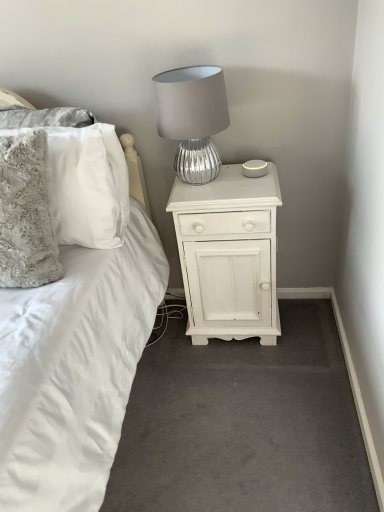
Question: Is white painted wood nightstand at center oriented away from fluffy gray pillow at left, the 2th pillow in the back-to-front sequence?

Choices:
 (A) no
 (B) yes

Answer: (A)

Question: Is white painted wood nightstand at center completely or partially outside of fluffy gray pillow at left, the 2th pillow in the back-to-front sequence?

Choices:
 (A) yes
 (B) no

Answer: (A)

Question: Does white painted wood nightstand at center lie behind fluffy gray pillow at left, marked as the 1th pillow in a front-to-back arrangement?

Choices:
 (A) yes
 (B) no

Answer: (A)

Question: Does white painted wood nightstand at center have a greater width compared to fluffy gray pillow at left, the 2th pillow in the back-to-front sequence?

Choices:
 (A) yes
 (B) no

Answer: (A)

Question: From the image's perspective, is white painted wood nightstand at center on fluffy gray pillow at left, the 2th pillow in the back-to-front sequence?

Choices:
 (A) no
 (B) yes

Answer: (A)

Question: Would you say fluffy white pillow at left, which is the second pillow from front to back, is inside or outside fluffy gray pillow at left, marked as the 1th pillow in a front-to-back arrangement?

Choices:
 (A) outside
 (B) inside

Answer: (A)

Question: In the image, is fluffy white pillow at left, the first pillow viewed from the back, positioned in front of or behind fluffy gray pillow at left, marked as the 1th pillow in a front-to-back arrangement?

Choices:
 (A) behind
 (B) front

Answer: (A)

Question: Considering the positions of point (61, 168) and point (9, 270), is point (61, 168) closer or farther from the camera than point (9, 270)?

Choices:
 (A) farther
 (B) closer

Answer: (A)

Question: From a real-world perspective, is fluffy white pillow at left, which is the second pillow from front to back, physically located above or below fluffy gray pillow at left, marked as the 1th pillow in a front-to-back arrangement?

Choices:
 (A) below
 (B) above

Answer: (A)

Question: Is fluffy gray pillow at left, the 2th pillow in the back-to-front sequence, in front of or behind fluffy white pillow at left, which is the second pillow from front to back, in the image?

Choices:
 (A) front
 (B) behind

Answer: (A)

Question: Choose the correct answer: Is fluffy gray pillow at left, marked as the 1th pillow in a front-to-back arrangement, inside fluffy white pillow at left, which is the second pillow from front to back, or outside it?

Choices:
 (A) inside
 (B) outside

Answer: (B)

Question: From a real-world perspective, is fluffy gray pillow at left, marked as the 1th pillow in a front-to-back arrangement, above or below fluffy white pillow at left, the first pillow viewed from the back?

Choices:
 (A) above
 (B) below

Answer: (A)

Question: From their relative heights in the image, would you say fluffy gray pillow at left, the 2th pillow in the back-to-front sequence, is taller or shorter than fluffy white pillow at left, which is the second pillow from front to back?

Choices:
 (A) short
 (B) tall

Answer: (B)

Question: Is white painted wood nightstand at center spatially inside fluffy gray pillow at left, marked as the 1th pillow in a front-to-back arrangement, or outside of it?

Choices:
 (A) inside
 (B) outside

Answer: (B)

Question: Is white painted wood nightstand at center wider or thinner than fluffy gray pillow at left, marked as the 1th pillow in a front-to-back arrangement?

Choices:
 (A) wide
 (B) thin

Answer: (A)